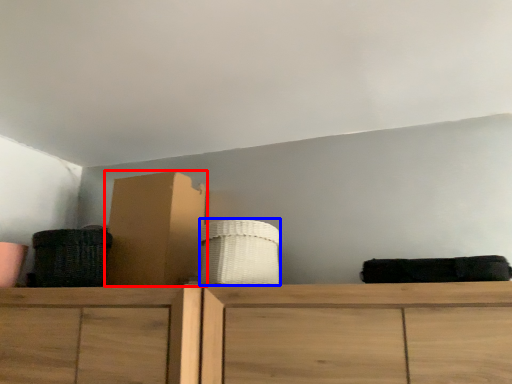
Question: Which point is closer to the camera, cardboard box (highlighted by a red box) or basket (highlighted by a blue box)?

Choices:
 (A) cardboard box
 (B) basket

Answer: (B)